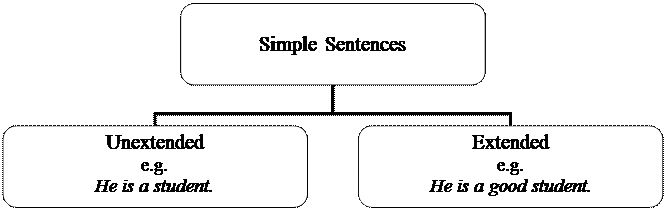
I want to click on right corner, so click(507, 114).